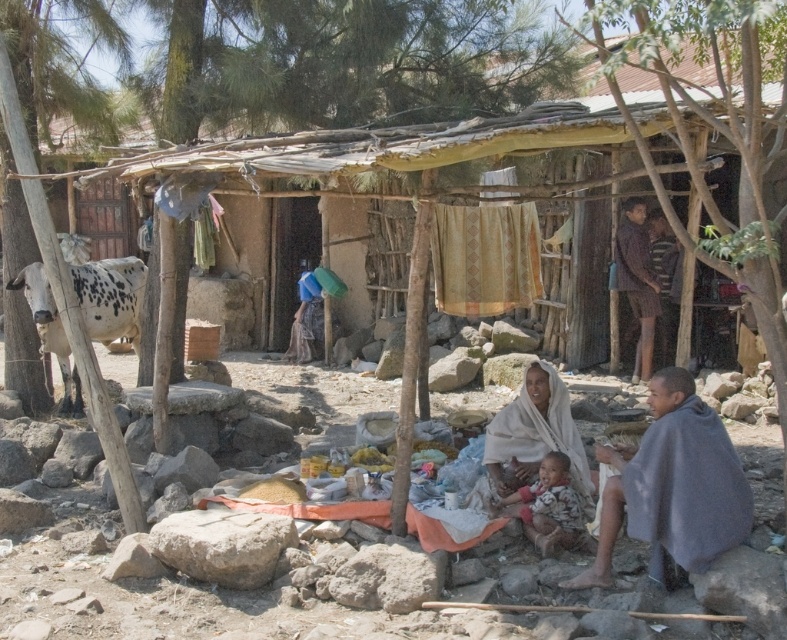
Question: Is gray rough rock at lower left thinner than striped shirt at upper right?

Choices:
 (A) no
 (B) yes

Answer: (A)

Question: Among these points, which one is nearest to the camera?

Choices:
 (A) (231, 570)
 (B) (643, 371)
 (C) (519, 428)

Answer: (A)

Question: Which is nearer to the fluffy white blanket at lower center?

Choices:
 (A) gray rough rock at lower left
 (B) white cloth at center
 (C) striped shirt at upper right
 (D) gray woolen shawl at lower right

Answer: (B)

Question: Can you confirm if gray woolen shawl at lower right is positioned to the left of striped shirt at upper right?

Choices:
 (A) no
 (B) yes

Answer: (B)

Question: Among these objects, which one is farthest from the camera?

Choices:
 (A) striped shirt at upper right
 (B) white cloth at center
 (C) gray woolen shawl at lower right

Answer: (A)

Question: Is gray woolen shawl at lower right bigger than striped shirt at upper right?

Choices:
 (A) no
 (B) yes

Answer: (B)